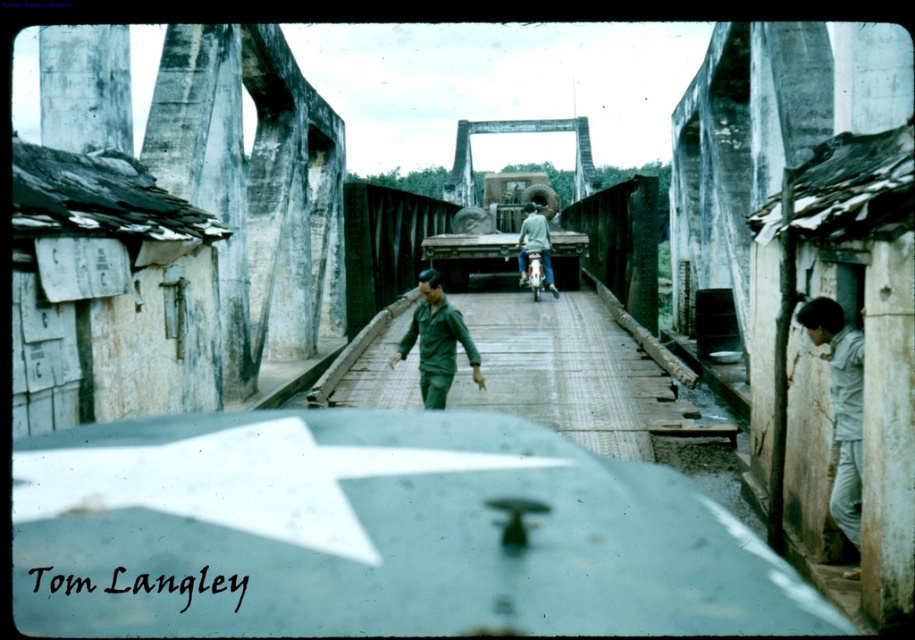
Which is above, gray fabric shirt at right or concrete bridge at center?

concrete bridge at center is above.

Is point (834, 512) closer to viewer compared to point (494, 122)?

Yes.

Identify the location of gray fabric shirt at right. (841, 406).

Which is above, green matte uniform at center or gray fabric jacket at center?

Positioned higher is gray fabric jacket at center.

Between point (434, 289) and point (522, 225), which one is positioned behind?

Point (522, 225)

Looking at this image, measure the distance between point (429, 387) and camera.

19.13 meters

Locate an element on the screen. green matte uniform at center is located at coordinates (436, 340).

Between point (797, 321) and point (555, 296), which one is positioned in front?

Positioned in front is point (797, 321).

Is gray fabric shirt at right shorter than gray fabric jacket at center?

Yes.

You are a GUI agent. You are given a task and a screenshot of the screen. Output one action in this format:
    pyautogui.click(x=<x>, y=<y>)
    Task: Click on the gray fabric shirt at right
    Image resolution: width=915 pixels, height=640 pixels.
    Given the screenshot: What is the action you would take?
    pyautogui.click(x=841, y=406)

What are the coordinates of `gray fabric shirt at right` in the screenshot? It's located at (841, 406).